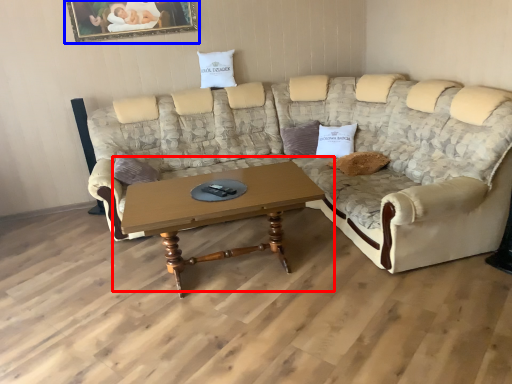
Question: Among these objects, which one is nearest to the camera, coffee table (highlighted by a red box) or picture frame (highlighted by a blue box)?

Choices:
 (A) coffee table
 (B) picture frame

Answer: (A)